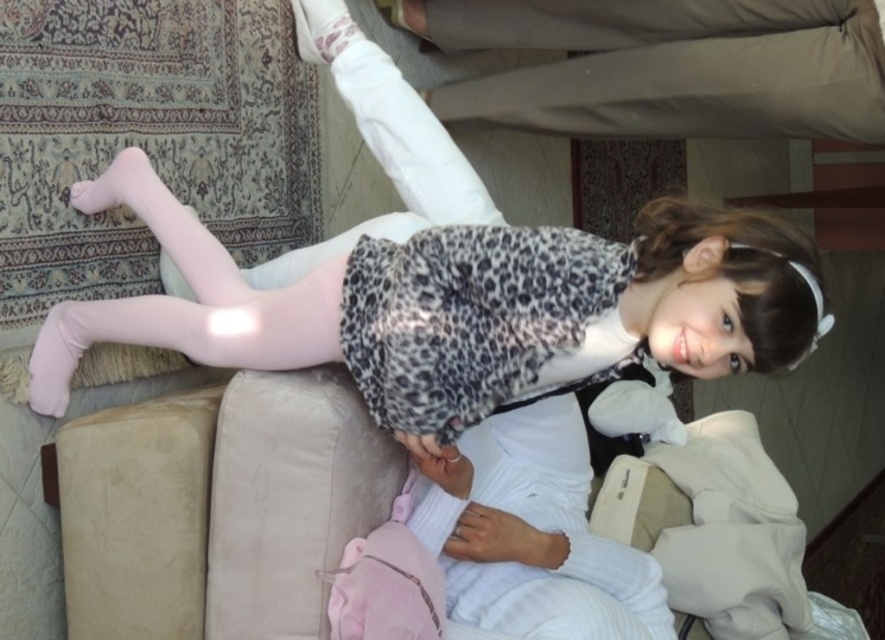
Question: Does matte white tights at upper center lie in front of beige cotton pants at upper center?

Choices:
 (A) no
 (B) yes

Answer: (B)

Question: Which of the following is the farthest from the observer?

Choices:
 (A) (656, 4)
 (B) (726, 211)

Answer: (A)

Question: Is matte white tights at upper center to the right of beige cotton pants at upper center from the viewer's perspective?

Choices:
 (A) no
 (B) yes

Answer: (A)

Question: Is matte white tights at upper center above beige cotton pants at upper center?

Choices:
 (A) no
 (B) yes

Answer: (A)

Question: Among these points, which one is nearest to the camera?

Choices:
 (A) (781, 88)
 (B) (483, 237)

Answer: (B)

Question: Which object appears closest to the camera in this image?

Choices:
 (A) beige cotton pants at upper center
 (B) matte white tights at upper center

Answer: (B)